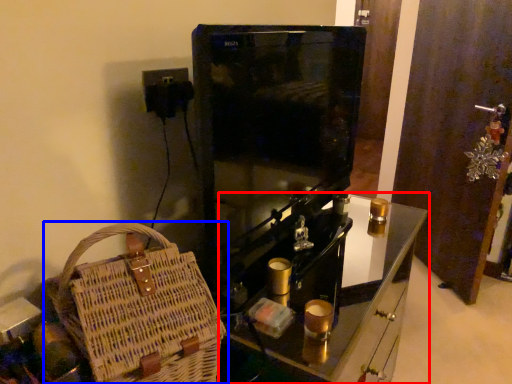
Question: Among these objects, which one is farthest to the camera, furniture (highlighted by a red box) or handbag (highlighted by a blue box)?

Choices:
 (A) furniture
 (B) handbag

Answer: (A)